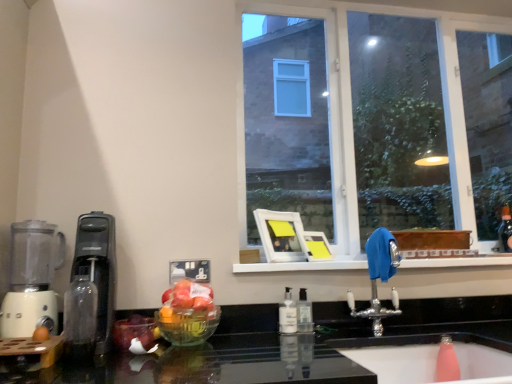
Locate an element on the screen. The width and height of the screenshot is (512, 384). vacant space situated above transparent glass bowl at center (from a real-world perspective) is located at coordinates (188, 291).